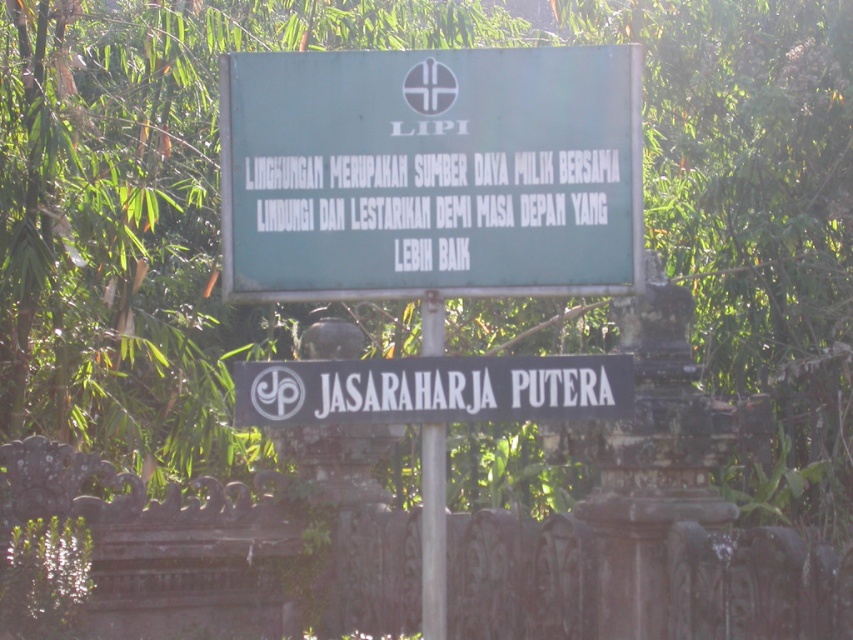
Question: Which object appears closest to the camera in this image?

Choices:
 (A) black wood sign at center
 (B) metallic pole at center

Answer: (A)

Question: Is green matte signboard at center thinner than black wood sign at center?

Choices:
 (A) yes
 (B) no

Answer: (B)

Question: Considering the relative positions of green matte signboard at center and metallic pole at center in the image provided, where is green matte signboard at center located with respect to metallic pole at center?

Choices:
 (A) right
 (B) left

Answer: (B)

Question: Which point is farther to the camera?

Choices:
 (A) black wood sign at center
 (B) green matte signboard at center
 (C) metallic pole at center

Answer: (C)

Question: Does black wood sign at center have a lesser width compared to metallic pole at center?

Choices:
 (A) yes
 (B) no

Answer: (B)

Question: Which point is farther to the camera?

Choices:
 (A) metallic pole at center
 (B) black wood sign at center
 (C) green matte signboard at center

Answer: (A)